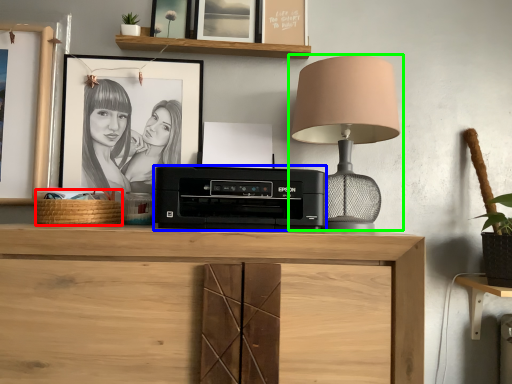
Question: Which object is the farthest from basket (highlighted by a red box)? Choose among these: printer (highlighted by a blue box) or lamp (highlighted by a green box).

Choices:
 (A) printer
 (B) lamp

Answer: (B)